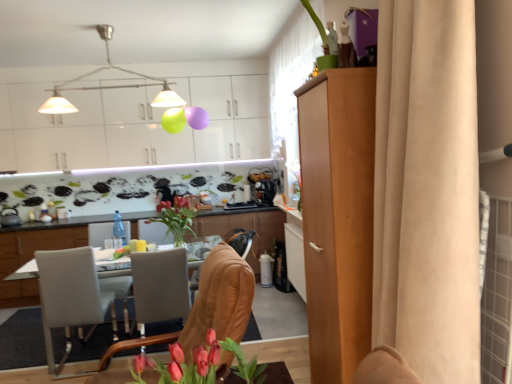
Question: Is satin black coffee machine at center further to camera compared to vivid red flowers in glass vase at center, which ranks as the 2th floral arrangement in right-to-left order?

Choices:
 (A) yes
 (B) no

Answer: (A)

Question: Is satin black coffee machine at center at the right side of vivid red flowers in glass vase at center, arranged as the 2th floral arrangement when ordered from the bottom?

Choices:
 (A) no
 (B) yes

Answer: (B)

Question: Does satin black coffee machine at center have a smaller size compared to vivid red flowers in glass vase at center, arranged as the 2th floral arrangement when ordered from the bottom?

Choices:
 (A) yes
 (B) no

Answer: (A)

Question: Does satin black coffee machine at center lie in front of vivid red flowers in glass vase at center, which ranks as the 2th floral arrangement in right-to-left order?

Choices:
 (A) yes
 (B) no

Answer: (B)

Question: From a real-world perspective, is satin black coffee machine at center positioned over vivid red flowers in glass vase at center, the 1th floral arrangement positioned from the back, based on gravity?

Choices:
 (A) yes
 (B) no

Answer: (A)

Question: In terms of height, does vivid red flowers in glass vase at center, which ranks as the 2th floral arrangement in right-to-left order, look taller or shorter compared to white glossy cabinets at upper center, marked as the third cabinetry in a front-to-back arrangement?

Choices:
 (A) tall
 (B) short

Answer: (B)

Question: Considering the positions of point (162, 213) and point (221, 152), is point (162, 213) closer or farther from the camera than point (221, 152)?

Choices:
 (A) closer
 (B) farther

Answer: (A)

Question: From the image's perspective, is vivid red flowers in glass vase at center, which appears as the 1th floral arrangement when viewed from the left, located above or below white glossy cabinets at upper center, marked as the third cabinetry in a front-to-back arrangement?

Choices:
 (A) below
 (B) above

Answer: (A)

Question: In terms of width, does vivid red flowers in glass vase at center, the 2th floral arrangement in the front-to-back sequence, look wider or thinner when compared to white glossy cabinets at upper center, marked as the third cabinetry in a front-to-back arrangement?

Choices:
 (A) thin
 (B) wide

Answer: (B)

Question: From their relative heights in the image, would you say satin black coffee machine at center is taller or shorter than white glossy table at center, the second cabinetry positioned from the front?

Choices:
 (A) tall
 (B) short

Answer: (B)

Question: Visually, is satin black coffee machine at center positioned to the left or to the right of white glossy table at center, the second cabinetry positioned from the front?

Choices:
 (A) right
 (B) left

Answer: (A)

Question: From the image's perspective, is satin black coffee machine at center positioned above or below white glossy table at center, which is the 2th cabinetry from back to front?

Choices:
 (A) below
 (B) above

Answer: (B)

Question: Looking at their shapes, would you say satin black coffee machine at center is wider or thinner than white glossy table at center, the second cabinetry positioned from the front?

Choices:
 (A) wide
 (B) thin

Answer: (B)

Question: From their relative heights in the image, would you say white leather armchair at left is taller or shorter than white leather chair at lower left, which appears as the 2th chair when viewed from the right?

Choices:
 (A) short
 (B) tall

Answer: (A)

Question: In terms of size, does white leather armchair at left appear bigger or smaller than white leather chair at lower left, the first chair from the back?

Choices:
 (A) big
 (B) small

Answer: (B)